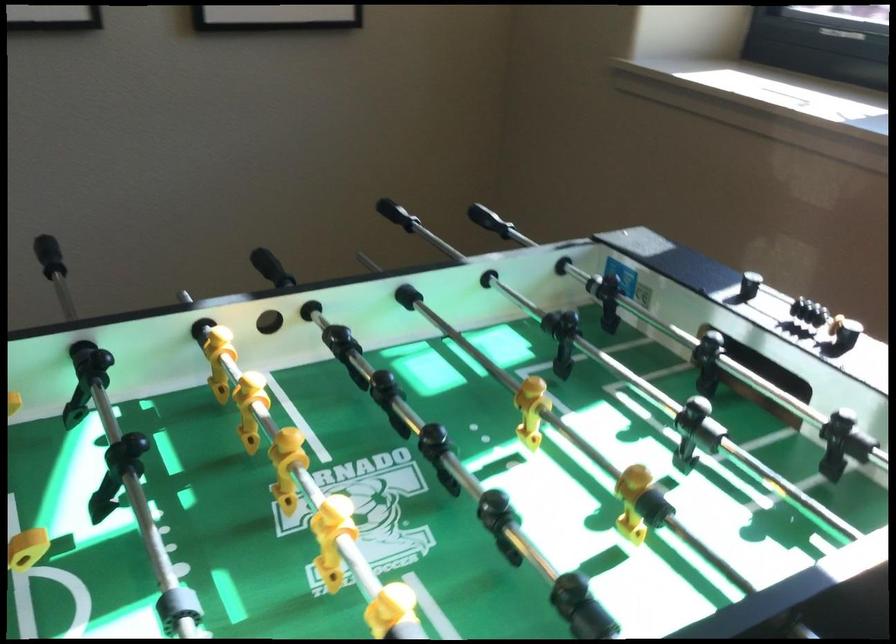
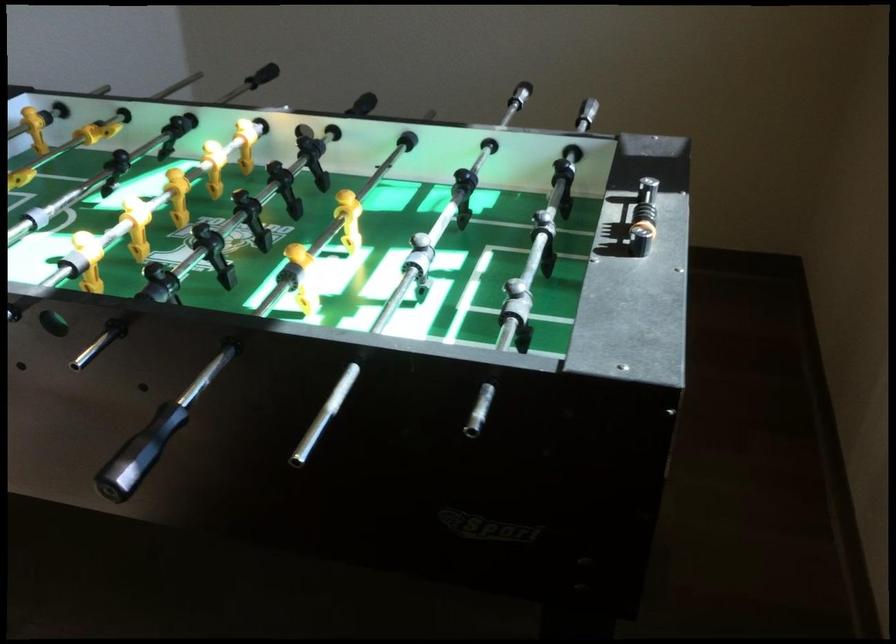
Question: The images are taken continuously from a first-person perspective. In which direction is your viewpoint rotating?

Choices:
 (A) Left
 (B) Right
 (C) Up
 (D) Down

Answer: (A)